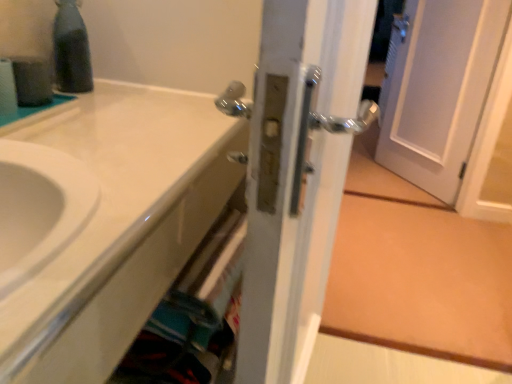
Question: From the image's perspective, would you say black glass bottle at upper left is positioned over white glossy sink at lower left?

Choices:
 (A) yes
 (B) no

Answer: (A)

Question: From a real-world perspective, is black glass bottle at upper left positioned over white glossy sink at lower left based on gravity?

Choices:
 (A) no
 (B) yes

Answer: (B)

Question: Could you tell me if black glass bottle at upper left is facing white glossy sink at lower left?

Choices:
 (A) yes
 (B) no

Answer: (B)

Question: From the image's perspective, would you say black glass bottle at upper left is shown under white glossy sink at lower left?

Choices:
 (A) yes
 (B) no

Answer: (B)

Question: Is white glossy sink at lower left located within black glass bottle at upper left?

Choices:
 (A) yes
 (B) no

Answer: (B)

Question: Does point (332, 34) appear closer or farther from the camera than point (225, 185)?

Choices:
 (A) closer
 (B) farther

Answer: (A)

Question: Considering the positions of satin nickel door handle at center and white glossy sink at lower left in the image, is satin nickel door handle at center wider or thinner than white glossy sink at lower left?

Choices:
 (A) wide
 (B) thin

Answer: (B)

Question: In terms of size, does satin nickel door handle at center appear bigger or smaller than white glossy sink at lower left?

Choices:
 (A) big
 (B) small

Answer: (A)

Question: From a real-world perspective, relative to white glossy sink at lower left, is satin nickel door handle at center vertically above or below?

Choices:
 (A) below
 (B) above

Answer: (A)

Question: From a real-world perspective, is white glossy sink at lower left above or below black glass bottle at upper left?

Choices:
 (A) above
 (B) below

Answer: (B)

Question: Considering the positions of white glossy sink at lower left and black glass bottle at upper left in the image, is white glossy sink at lower left bigger or smaller than black glass bottle at upper left?

Choices:
 (A) big
 (B) small

Answer: (A)

Question: Is white glossy sink at lower left wider or thinner than black glass bottle at upper left?

Choices:
 (A) thin
 (B) wide

Answer: (B)

Question: Based on their positions, is white glossy sink at lower left located to the left or right of black glass bottle at upper left?

Choices:
 (A) right
 (B) left

Answer: (A)

Question: Is black glass bottle at upper left taller or shorter than satin nickel door handle at center?

Choices:
 (A) short
 (B) tall

Answer: (A)

Question: Considering their positions, is black glass bottle at upper left located in front of or behind satin nickel door handle at center?

Choices:
 (A) front
 (B) behind

Answer: (B)